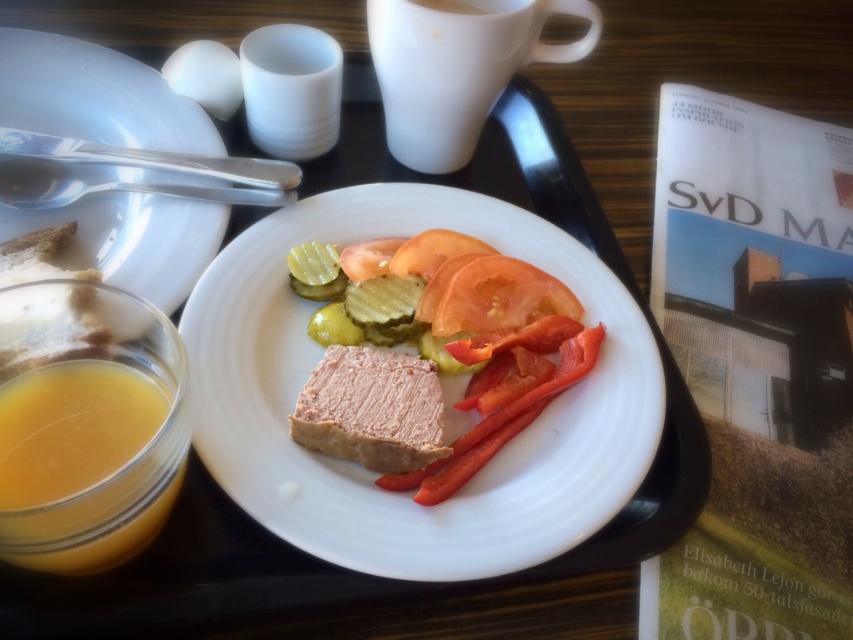
Question: Does pinkish matte/powdery spread at center have a smaller size compared to white glossy plate at upper left?

Choices:
 (A) yes
 (B) no

Answer: (A)

Question: Does white matte plate at center have a lesser width compared to sliced matte tomato at center?

Choices:
 (A) yes
 (B) no

Answer: (B)

Question: Does white glossy plate at upper left appear over sliced red tomato at center?

Choices:
 (A) no
 (B) yes

Answer: (B)

Question: Which of the following is the closest to the observer?

Choices:
 (A) (466, 301)
 (B) (65, 502)

Answer: (B)

Question: Among these points, which one is nearest to the camera?

Choices:
 (A) (99, 230)
 (B) (140, 452)
 (C) (419, 424)

Answer: (B)

Question: Which point is closer to the camera?

Choices:
 (A) (107, 122)
 (B) (421, 408)
 (C) (108, 536)
 (D) (409, 548)

Answer: (C)